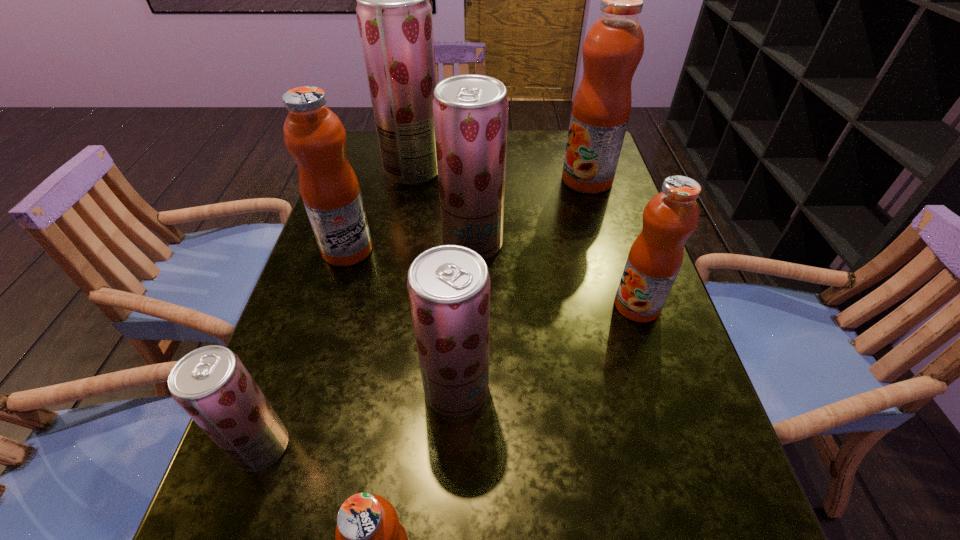
Find the location of a particular element. Image resolution: width=960 pixels, height=540 pixels. the seventh farthest fruit juice is located at coordinates (211, 384).

The height and width of the screenshot is (540, 960). Identify the location of the nearest strawberry fruit juice. (211, 384).

The height and width of the screenshot is (540, 960). I want to click on free space located 0.160m on the front of the biggest strawberry fruit juice, so click(403, 224).

At what (x,y) coordinates should I click in order to perform the action: click on free space located on the front label of the farthest orange fruit juice. Please return your answer as a coordinate pair (x, y). This screenshot has height=540, width=960. Looking at the image, I should click on (540, 180).

This screenshot has height=540, width=960. Identify the location of vacant position located 0.070m on the front label of the farthest orange fruit juice. (537, 180).

At what (x,y) coordinates should I click in order to perform the action: click on free space located on the front label of the farthest orange fruit juice. Please return your answer as a coordinate pair (x, y). Looking at the image, I should click on (438, 180).

This screenshot has height=540, width=960. In order to click on vacant space located on the right of the third nearest strawberry fruit juice in this screenshot , I will do `click(523, 244)`.

Find the location of a particular element. Image resolution: width=960 pixels, height=540 pixels. free location located 0.280m on the front label of the leftmost orange fruit juice is located at coordinates (492, 250).

Where is `vacant space located on the back of the second nearest strawberry fruit juice`? vacant space located on the back of the second nearest strawberry fruit juice is located at coordinates (459, 332).

Where is `free region located on the front label of the second nearest orange fruit juice`? This screenshot has width=960, height=540. free region located on the front label of the second nearest orange fruit juice is located at coordinates (566, 306).